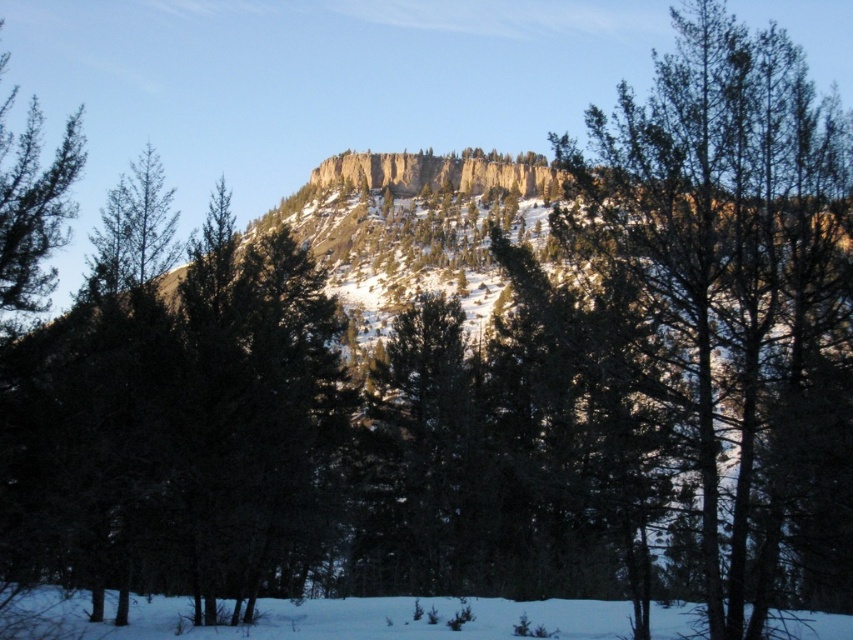
Question: Is green textured tree at center smaller than green matte tree at left?

Choices:
 (A) no
 (B) yes

Answer: (A)

Question: Does green textured tree at center appear on the left side of green matte tree at left?

Choices:
 (A) yes
 (B) no

Answer: (B)

Question: Which of the following is the closest to the observer?

Choices:
 (A) green matte tree at left
 (B) green textured tree at center

Answer: (B)

Question: Which point is farther to the camera?

Choices:
 (A) green textured tree at center
 (B) green matte tree at left

Answer: (B)

Question: In this image, where is green textured tree at center located relative to green matte tree at left?

Choices:
 (A) left
 (B) right

Answer: (B)